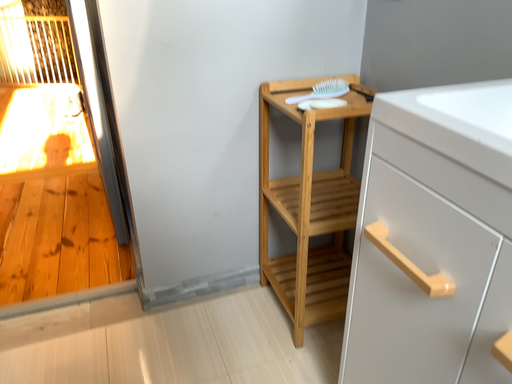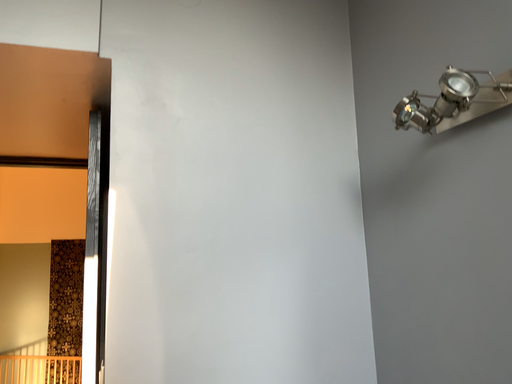
Question: How did the camera likely rotate when shooting the video?

Choices:
 (A) rotated downward
 (B) rotated upward

Answer: (B)